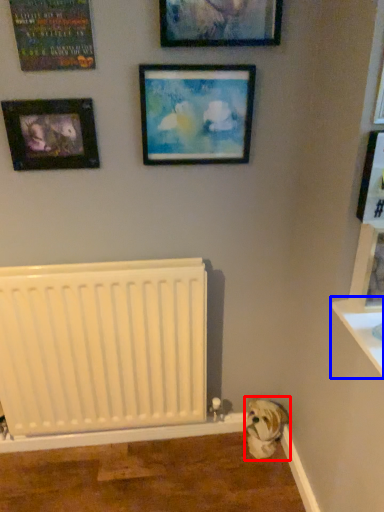
Question: Among these objects, which one is nearest to the camera, animal (highlighted by a red box) or window sill (highlighted by a blue box)?

Choices:
 (A) animal
 (B) window sill

Answer: (B)